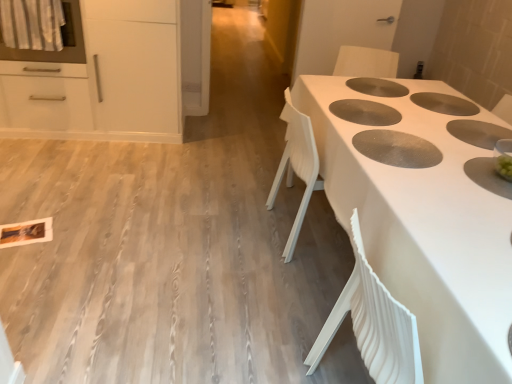
Image resolution: width=512 pixels, height=384 pixels. What do you see at coordinates (114, 77) in the screenshot?
I see `white matte cabinet at upper left` at bounding box center [114, 77].

The image size is (512, 384). I want to click on white textured table at center, so click(416, 225).

At what (x,y) coordinates should I click in order to perform the action: click on white matte cabinet at upper left. Please return your answer as a coordinate pair (x, y). Looking at the image, I should click on (114, 77).

Between white textured table at center and white glossy oven at upper left, which one appears on the right side from the viewer's perspective?

white textured table at center is more to the right.

In terms of size, does white textured table at center appear bigger or smaller than white glossy oven at upper left?

In the image, white textured table at center appears to be larger than white glossy oven at upper left.

From a real-world perspective, between white textured table at center and white glossy oven at upper left, who is vertically higher?

white glossy oven at upper left.

From the image's perspective, does white textured table at center appear higher than white glossy oven at upper left?

Actually, white textured table at center appears below white glossy oven at upper left in the image.

From a real-world perspective, is white glossy oven at upper left over white matte cabinet at upper left?

Yes.

Can you confirm if white glossy oven at upper left is shorter than white matte cabinet at upper left?

Correct, white glossy oven at upper left is not as tall as white matte cabinet at upper left.

Is white glossy oven at upper left not close to white matte cabinet at upper left?

white glossy oven at upper left is actually quite close to white matte cabinet at upper left.

Does white glossy oven at upper left turn towards white matte cabinet at upper left?

Yes, white glossy oven at upper left is facing white matte cabinet at upper left.

Looking at this image, is the position of white glossy oven at upper left less distant than that of white plastic chair at center?

No.

Can you confirm if white glossy oven at upper left is taller than white plastic chair at center?

In fact, white glossy oven at upper left may be shorter than white plastic chair at center.

Between point (74, 21) and point (361, 61), which one is positioned in front?

The point (74, 21) is closer to the camera.

Would you say white plastic chair at center is part of white glossy oven at upper left's contents?

Definitely not — white plastic chair at center is not inside white glossy oven at upper left.

Between white plastic chair at center and white matte cabinet at upper left, which one has larger size?

white matte cabinet at upper left.

Which of these two, white plastic chair at center or white matte cabinet at upper left, stands taller?

white matte cabinet at upper left is taller.

Where is `cabinetry behind the white plastic chair at center`? cabinetry behind the white plastic chair at center is located at coordinates (114, 77).

Visually, is white matte cabinet at upper left positioned to the left or to the right of white textured table at center?

In the image, white matte cabinet at upper left appears on the left side of white textured table at center.

From the image's perspective, between white matte cabinet at upper left and white textured table at center, who is located below?

white textured table at center.

Is white matte cabinet at upper left taller or shorter than white textured table at center?

Considering their sizes, white matte cabinet at upper left has more height than white textured table at center.

From the image's perspective, between white textured table at center and white matte cabinet at upper left, which one is located above?

white matte cabinet at upper left appears higher in the image.

Is white textured table at center oriented away from white matte cabinet at upper left?

No, white textured table at center is not facing away from white matte cabinet at upper left.

Is white textured table at center behind white matte cabinet at upper left?

No, the depth of white textured table at center is less than that of white matte cabinet at upper left.

How far apart are white textured table at center and white matte cabinet at upper left?

white textured table at center is 5.70 feet away from white matte cabinet at upper left.

Between point (11, 130) and point (78, 1), which one is positioned in front?

The point (78, 1) is closer to the camera.

Is white matte cabinet at upper left in front of white glossy oven at upper left?

Yes.

Image resolution: width=512 pixels, height=384 pixels. I want to click on oven behind the white matte cabinet at upper left, so click(x=62, y=40).

Which of these two, white matte cabinet at upper left or white glossy oven at upper left, is smaller?

white glossy oven at upper left.

Identify the location of countertop lying in front of the white glossy oven at upper left. This screenshot has width=512, height=384. (416, 225).

You are a GUI agent. You are given a task and a screenshot of the screen. Output one action in this format:
    pyautogui.click(x=<x>, y=<y>)
    Task: Click on the oven on the left of the white matte cabinet at upper left
    The image size is (512, 384).
    Given the screenshot: What is the action you would take?
    pyautogui.click(x=62, y=40)

When comparing their distances from white glossy oven at upper left, does white textured table at center or white matte cabinet at upper left seem closer?

white matte cabinet at upper left lies closer to white glossy oven at upper left than the other object.

Which object lies nearer to the anchor point white textured table at center, white plastic chair at center or white glossy oven at upper left?

Among the two, white plastic chair at center is located nearer to white textured table at center.

Considering their positions, is white glossy oven at upper left positioned further to white matte cabinet at upper left than white plastic chair at center?

white plastic chair at center.

Considering their positions, is white plastic chair at center positioned closer to white glossy oven at upper left than white textured table at center?

white plastic chair at center.

Looking at the image, which one is located further to white textured table at center, white glossy oven at upper left or white matte cabinet at upper left?

white glossy oven at upper left.

Considering their positions, is white matte cabinet at upper left positioned further to white textured table at center than white glossy oven at upper left?

white glossy oven at upper left.

When comparing their distances from white matte cabinet at upper left, does white plastic chair at center or white glossy oven at upper left seem further?

white plastic chair at center is further to white matte cabinet at upper left.

Which object lies further to the anchor point white matte cabinet at upper left, white plastic chair at center or white textured table at center?

Based on the image, white textured table at center appears to be further to white matte cabinet at upper left.

The width and height of the screenshot is (512, 384). Find the location of `cabinetry between white glossy oven at upper left and white textured table at center from left to right`. cabinetry between white glossy oven at upper left and white textured table at center from left to right is located at coordinates (114, 77).

At what (x,y) coordinates should I click in order to perform the action: click on chair between white matte cabinet at upper left and white textured table at center from left to right. Please return your answer as a coordinate pair (x, y). Looking at the image, I should click on (366, 62).

Identify the location of chair situated between white glossy oven at upper left and white textured table at center from left to right. The image size is (512, 384). (366, 62).

Find the location of a particular element. cabinetry between white glossy oven at upper left and white plastic chair at center in the horizontal direction is located at coordinates (114, 77).